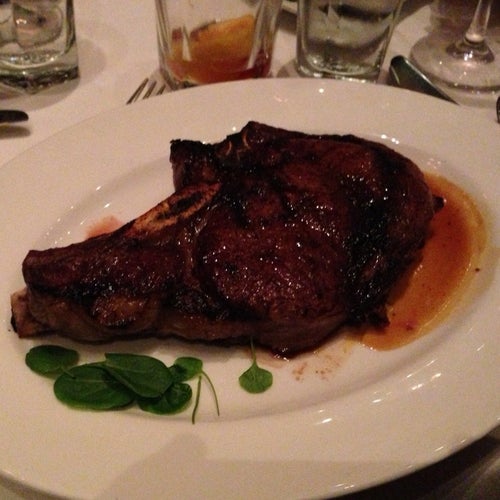
Where is `table`? This screenshot has height=500, width=500. table is located at coordinates click(127, 21).